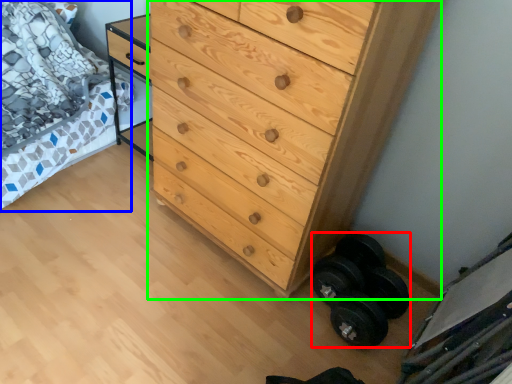
Question: Considering the real-world distances, which object is farthest from dumbbell (highlighted by a red box)? bed (highlighted by a blue box) or chest of drawers (highlighted by a green box)?

Choices:
 (A) bed
 (B) chest of drawers

Answer: (A)